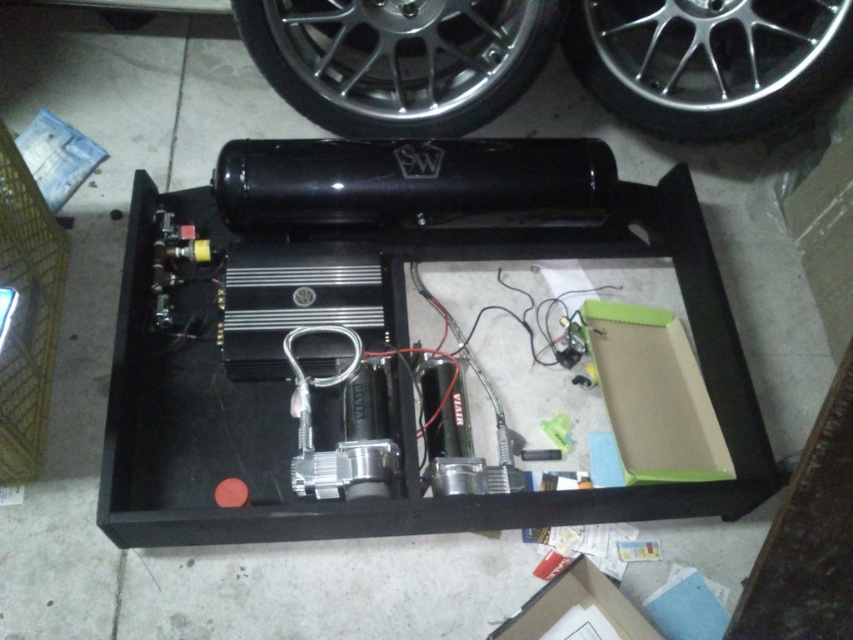
This screenshot has width=853, height=640. Describe the element at coordinates (398, 60) in the screenshot. I see `silver metallic wheel at upper center` at that location.

Between silver metallic wheel at upper center and chrome metallic wheel at upper center, which one is positioned lower?

silver metallic wheel at upper center is below.

This screenshot has height=640, width=853. What are the coordinates of `silver metallic wheel at upper center` in the screenshot? It's located at (398, 60).